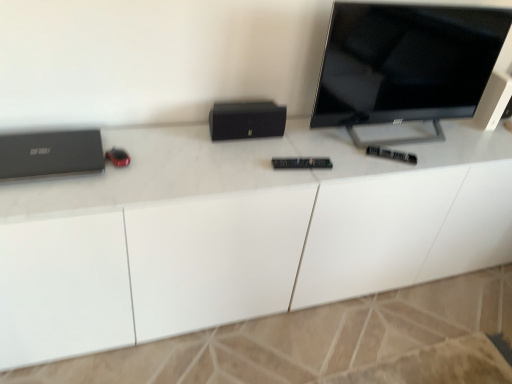
Locate an element on the screen. This screenshot has width=512, height=384. free location to the right of matte black laptop at left is located at coordinates (132, 172).